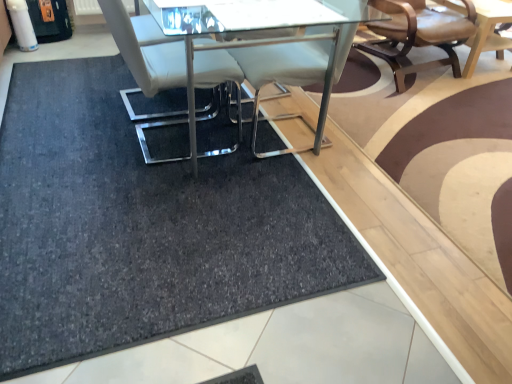
Question: Does white leather chair at center, which is the first chair from left to right, have a greater height compared to dark gray carpet at center?

Choices:
 (A) no
 (B) yes

Answer: (B)

Question: From the image's perspective, is white leather chair at center, which is the first chair from left to right, beneath dark gray carpet at center?

Choices:
 (A) no
 (B) yes

Answer: (A)

Question: Is white leather chair at center, the first chair when ordered from front to back, not close to dark gray carpet at center?

Choices:
 (A) no
 (B) yes

Answer: (A)

Question: From a real-world perspective, is white leather chair at center, which is counted as the 2th chair, starting from the right, beneath dark gray carpet at center?

Choices:
 (A) yes
 (B) no

Answer: (B)

Question: Considering the relative sizes of white leather chair at center, which is counted as the 2th chair, starting from the right, and dark gray carpet at center in the image provided, is white leather chair at center, which is counted as the 2th chair, starting from the right, bigger than dark gray carpet at center?

Choices:
 (A) no
 (B) yes

Answer: (B)

Question: Considering the relative sizes of white leather chair at center, which is counted as the 2th chair, starting from the right, and dark gray carpet at center in the image provided, is white leather chair at center, which is counted as the 2th chair, starting from the right, shorter than dark gray carpet at center?

Choices:
 (A) yes
 (B) no

Answer: (B)

Question: Is the depth of leather seat at upper right, placed as the first chair when sorted from right to left, greater than that of white leather chair at center, the first chair when ordered from front to back?

Choices:
 (A) no
 (B) yes

Answer: (B)

Question: Can you confirm if leather seat at upper right, the second chair viewed from the front, is thinner than white leather chair at center, the first chair when ordered from front to back?

Choices:
 (A) yes
 (B) no

Answer: (B)

Question: Is leather seat at upper right, placed as the 2th chair when sorted from left to right, positioned with its back to white leather chair at center, the second chair in the back-to-front sequence?

Choices:
 (A) no
 (B) yes

Answer: (A)

Question: Considering the relative sizes of leather seat at upper right, which appears as the first chair when viewed from the back, and white leather chair at center, which is counted as the 2th chair, starting from the right, in the image provided, is leather seat at upper right, which appears as the first chair when viewed from the back, wider than white leather chair at center, which is counted as the 2th chair, starting from the right,?

Choices:
 (A) yes
 (B) no

Answer: (A)

Question: From a real-world perspective, is leather seat at upper right, which appears as the first chair when viewed from the back, located higher than white leather chair at center, the second chair in the back-to-front sequence?

Choices:
 (A) yes
 (B) no

Answer: (B)

Question: Is the position of leather seat at upper right, placed as the 2th chair when sorted from left to right, less distant than that of white leather chair at center, which is the first chair from left to right?

Choices:
 (A) yes
 (B) no

Answer: (B)

Question: Does leather seat at upper right, placed as the 2th chair when sorted from left to right, have a greater height compared to dark gray carpet at center?

Choices:
 (A) yes
 (B) no

Answer: (A)